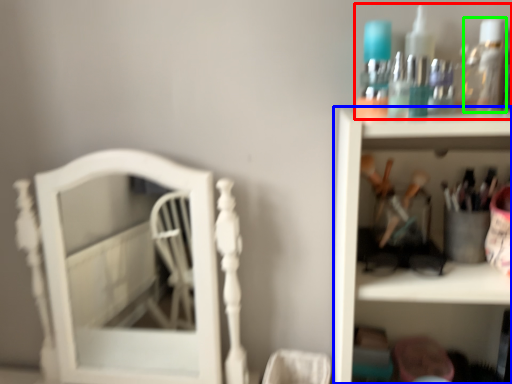
Question: Which object is the closest to the collection (highlighted by a red box)? Choose among these: shelf (highlighted by a blue box) or mouthwash (highlighted by a green box).

Choices:
 (A) shelf
 (B) mouthwash

Answer: (B)